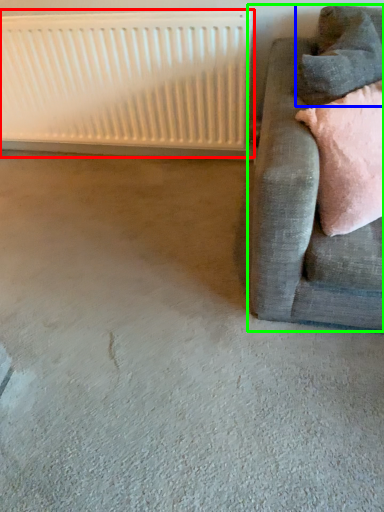
Question: Based on their relative distances, which object is nearer to radiator (highlighted by a red box)? Choose from pillow (highlighted by a blue box) and studio couch (highlighted by a green box).

Choices:
 (A) pillow
 (B) studio couch

Answer: (B)